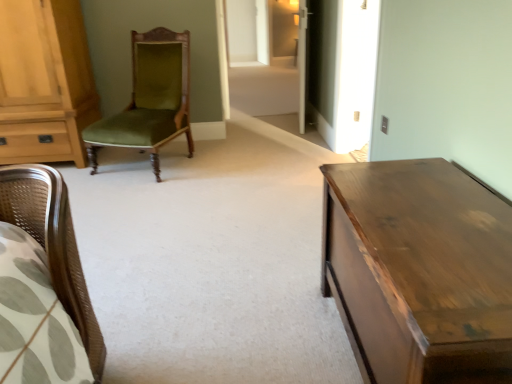
Question: Can you confirm if shiny brown wooden table at right is positioned to the right of transparent glass door at center?

Choices:
 (A) no
 (B) yes

Answer: (B)

Question: Is shiny brown wooden table at right facing away from transparent glass door at center?

Choices:
 (A) no
 (B) yes

Answer: (A)

Question: Is transparent glass door at center surrounded by shiny brown wooden table at right?

Choices:
 (A) no
 (B) yes

Answer: (A)

Question: Considering the relative positions of shiny brown wooden table at right and transparent glass door at center in the image provided, is shiny brown wooden table at right to the left of transparent glass door at center from the viewer's perspective?

Choices:
 (A) no
 (B) yes

Answer: (A)

Question: Can we say shiny brown wooden table at right lies outside transparent glass door at center?

Choices:
 (A) no
 (B) yes

Answer: (B)

Question: Considering the relative sizes of shiny brown wooden table at right and transparent glass door at center in the image provided, is shiny brown wooden table at right smaller than transparent glass door at center?

Choices:
 (A) no
 (B) yes

Answer: (A)

Question: Is light brown wood cabinet at left looking in the opposite direction of green velvet chair at center?

Choices:
 (A) no
 (B) yes

Answer: (A)

Question: Considering the relative sizes of light brown wood cabinet at left and green velvet chair at center in the image provided, is light brown wood cabinet at left taller than green velvet chair at center?

Choices:
 (A) no
 (B) yes

Answer: (B)

Question: From a real-world perspective, is light brown wood cabinet at left located higher than green velvet chair at center?

Choices:
 (A) no
 (B) yes

Answer: (B)

Question: Considering the relative sizes of light brown wood cabinet at left and green velvet chair at center in the image provided, is light brown wood cabinet at left smaller than green velvet chair at center?

Choices:
 (A) no
 (B) yes

Answer: (A)

Question: From the image's perspective, is light brown wood cabinet at left over green velvet chair at center?

Choices:
 (A) no
 (B) yes

Answer: (B)

Question: Is light brown wood cabinet at left not inside green velvet chair at center?

Choices:
 (A) yes
 (B) no

Answer: (A)

Question: Is light brown wood cabinet at left thinner than shiny brown wooden table at right?

Choices:
 (A) yes
 (B) no

Answer: (B)